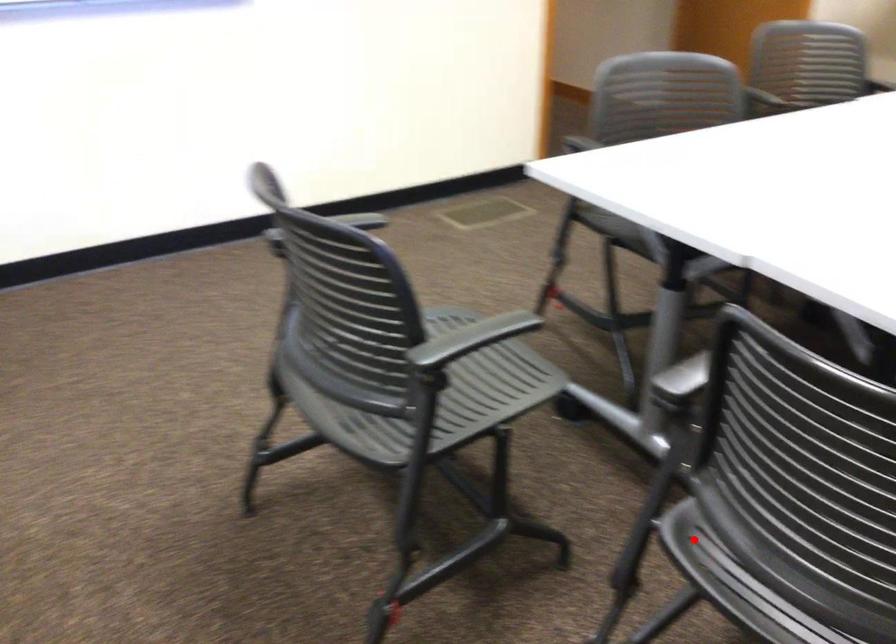
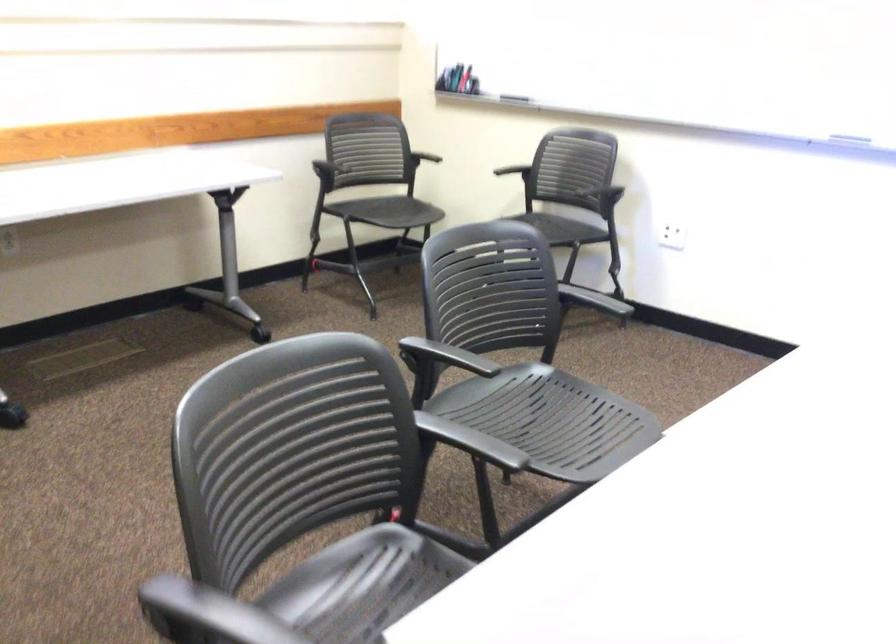
Question: A red point is marked in image1. In image2, is the corresponding 3D point closer to the camera or farther? Reply with the corresponding letter.

Choices:
 (A) The corresponding 3D point is closer.
 (B) The corresponding 3D point is farther.

Answer: (B)